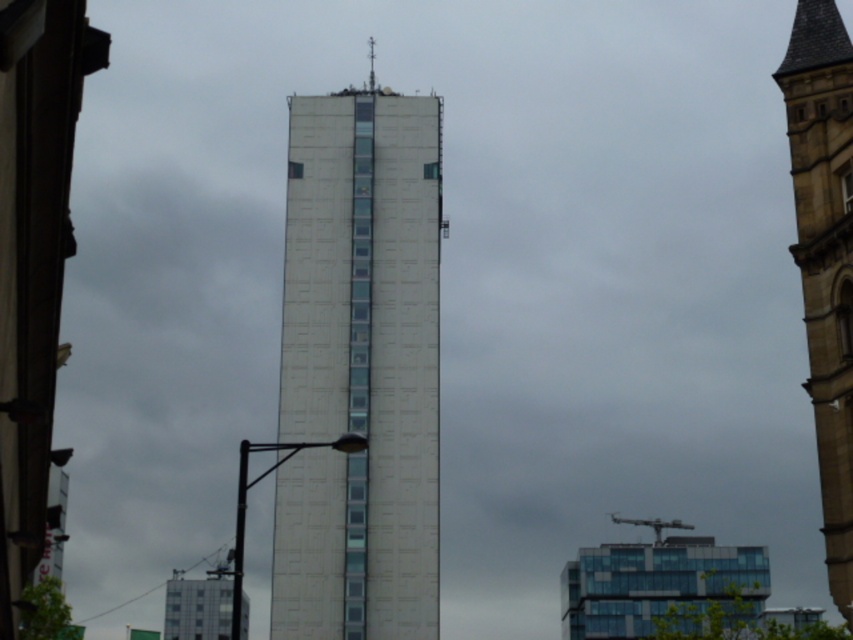
From the picture: You are standing in front of the tall modern building and want to determine the relative positions of two points marked on the building. The first point is at coordinate point (x=305, y=529) and the second is at point (x=370, y=83). Which point is closer to you?

Point (x=305, y=529) is closer to the viewer than point (x=370, y=83).

You are a city planner reviewing blueprints and notice the white textured building at center. Based on its coordinates, is it positioned closer to the left or right side of the urban area?

The white textured building at center is located at point (358, 369), which places it closer to the right side of the urban area since the x coordinate 0.578 is greater than 0.5.

You are standing in front of the tall modern building and want to take a photo of both the stone tower at center and the metallic spire at upper center. Which object will appear larger in your photo?

The stone tower at center will appear larger in the photo because it is closer to the viewer than the metallic spire at upper center.